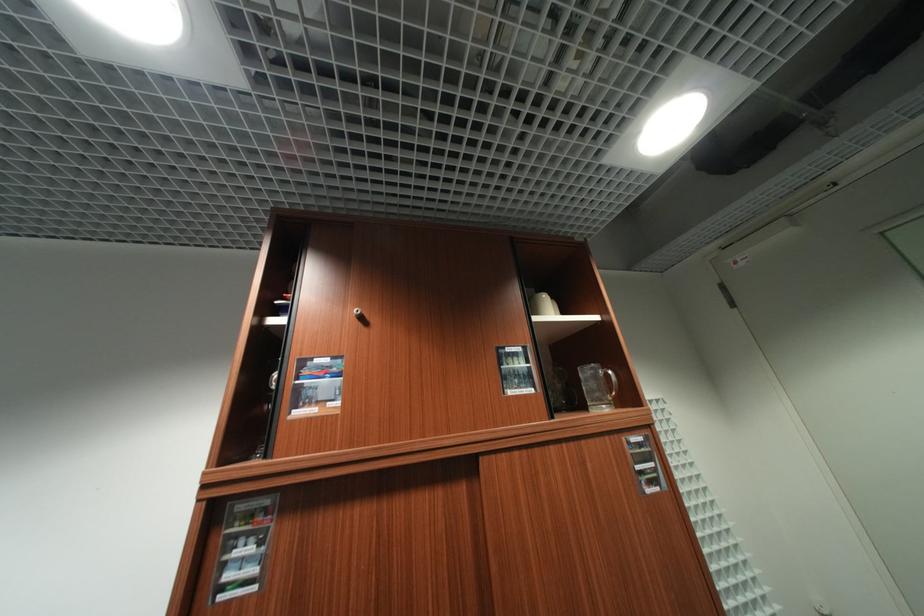
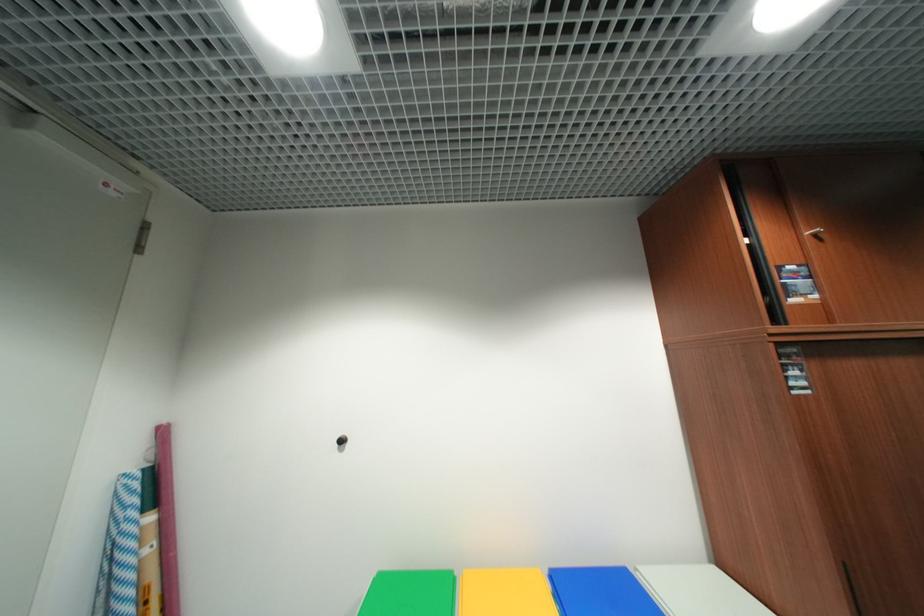
The images are taken continuously from a first-person perspective. In which direction are you moving?

The movement direction of the cameraman is left, backward.